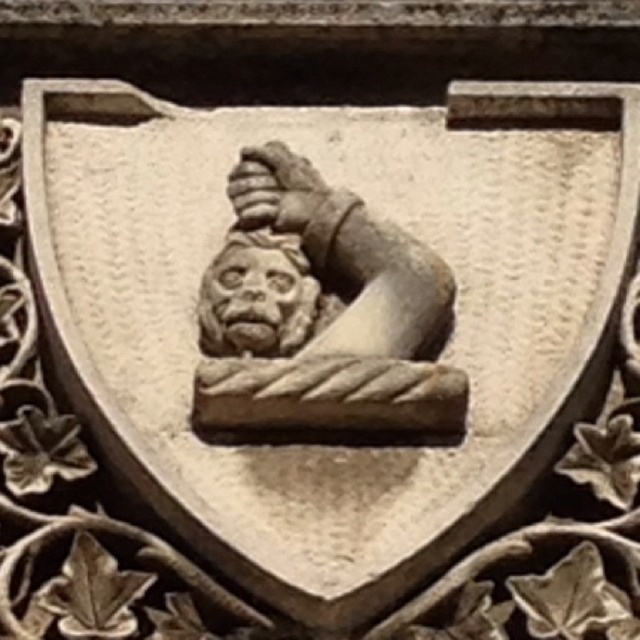
You are an art conservator examining the shield carving. You notice two central elements, the stone textured gargoyle at center and the carved stone face at center. From your perspective, which one is positioned to the right?

The stone textured gargoyle at center is to the right of the carved stone face at center, so the stone textured gargoyle at center is positioned to the right.

You are an art conservator examining the shield carving. You notice a specific point at coordinates (321, 312). What object is located precisely at this point?

The stone textured gargoyle at center is located precisely at point (321, 312).